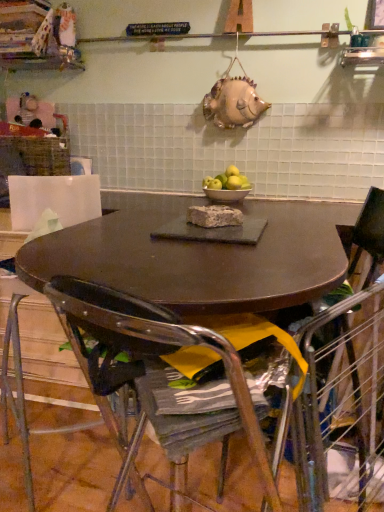
Question: Can you confirm if metallic wire armchair at lower right is smaller than brown crumbly cake at center?

Choices:
 (A) no
 (B) yes

Answer: (A)

Question: From a real-world perspective, is metallic wire armchair at lower right located beneath brown crumbly cake at center?

Choices:
 (A) yes
 (B) no

Answer: (A)

Question: Does metallic wire armchair at lower right have a larger size compared to brown crumbly cake at center?

Choices:
 (A) yes
 (B) no

Answer: (A)

Question: Considering the relative sizes of metallic wire armchair at lower right and brown crumbly cake at center in the image provided, is metallic wire armchair at lower right wider than brown crumbly cake at center?

Choices:
 (A) yes
 (B) no

Answer: (A)

Question: Is metallic wire armchair at lower right oriented away from brown crumbly cake at center?

Choices:
 (A) no
 (B) yes

Answer: (B)

Question: Is metallic wire armchair at lower right positioned before brown crumbly cake at center?

Choices:
 (A) yes
 (B) no

Answer: (A)

Question: From a real-world perspective, does white ceramic bowl at center stand above brown crumbly cake at center?

Choices:
 (A) no
 (B) yes

Answer: (A)

Question: Is white ceramic bowl at center positioned beyond the bounds of brown crumbly cake at center?

Choices:
 (A) yes
 (B) no

Answer: (A)

Question: Can you see white ceramic bowl at center touching brown crumbly cake at center?

Choices:
 (A) no
 (B) yes

Answer: (A)

Question: Is white ceramic bowl at center smaller than brown crumbly cake at center?

Choices:
 (A) yes
 (B) no

Answer: (B)

Question: From the image's perspective, does white ceramic bowl at center appear lower than brown crumbly cake at center?

Choices:
 (A) no
 (B) yes

Answer: (A)

Question: Is white ceramic bowl at center far from brown crumbly cake at center?

Choices:
 (A) yes
 (B) no

Answer: (B)

Question: Is metallic wire armchair at lower right completely or partially outside of metallic wire chair at lower right, the 1th chair from the back?

Choices:
 (A) yes
 (B) no

Answer: (A)